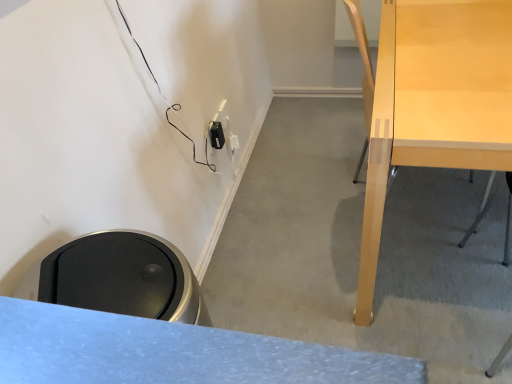
Question: Is the position of black plastic electric outlet at lower center less distant than that of light wood desk at right?

Choices:
 (A) yes
 (B) no

Answer: (B)

Question: From a real-world perspective, does black plastic electric outlet at lower center sit lower than light wood desk at right?

Choices:
 (A) yes
 (B) no

Answer: (B)

Question: From the image's perspective, is black plastic electric outlet at lower center under light wood desk at right?

Choices:
 (A) yes
 (B) no

Answer: (B)

Question: Is black plastic electric outlet at lower center outside of light wood desk at right?

Choices:
 (A) yes
 (B) no

Answer: (A)

Question: Can you confirm if black plastic electric outlet at lower center is positioned to the right of light wood desk at right?

Choices:
 (A) no
 (B) yes

Answer: (A)

Question: Is black plastic electric outlet at lower center facing away from light wood desk at right?

Choices:
 (A) no
 (B) yes

Answer: (A)

Question: Does light wood desk at right turn towards black plastic electric outlet at lower center?

Choices:
 (A) no
 (B) yes

Answer: (A)

Question: Could black plastic electric outlet at lower center be considered to be inside light wood desk at right?

Choices:
 (A) yes
 (B) no

Answer: (B)

Question: Can you confirm if light wood desk at right is smaller than black plastic electric outlet at lower center?

Choices:
 (A) yes
 (B) no

Answer: (B)

Question: Does light wood desk at right lie in front of black plastic electric outlet at lower center?

Choices:
 (A) yes
 (B) no

Answer: (A)

Question: Would you say light wood desk at right is a long distance from black plastic electric outlet at lower center?

Choices:
 (A) yes
 (B) no

Answer: (B)

Question: From the image's perspective, is light wood desk at right under black plastic electric outlet at lower center?

Choices:
 (A) no
 (B) yes

Answer: (B)

Question: From a real-world perspective, is black plastic electric outlet at lower center positioned above or below light wood desk at right?

Choices:
 (A) below
 (B) above

Answer: (B)